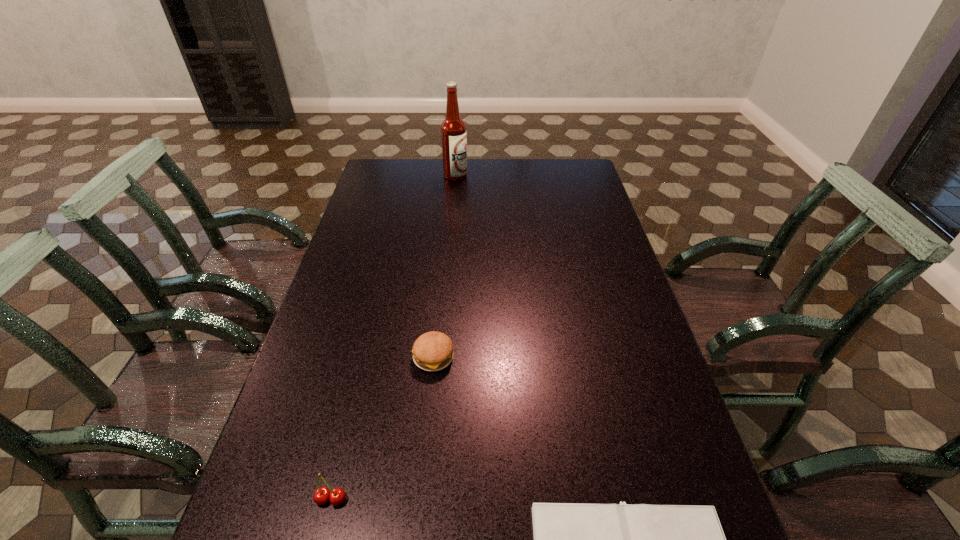
Identify the location of vacant space at the far edge of the desktop. (528, 185).

Image resolution: width=960 pixels, height=540 pixels. Find the location of `vacant area at the left edge of the desktop`. vacant area at the left edge of the desktop is located at coordinates (336, 474).

This screenshot has width=960, height=540. What are the coordinates of `free space at the right edge` in the screenshot? It's located at tap(601, 326).

Locate an element on the screen. The width and height of the screenshot is (960, 540). vacant position at the far left corner of the desktop is located at coordinates (387, 159).

Identify the location of vacant space at the far right corner of the desktop. (579, 174).

At what (x,y) coordinates should I click in order to perform the action: click on vacant area between the cherry and the alcohol. Please return your answer as a coordinate pair (x, y). The width and height of the screenshot is (960, 540). Looking at the image, I should click on (394, 337).

Where is `empty location between the third shortest object and the tallest object`? The image size is (960, 540). empty location between the third shortest object and the tallest object is located at coordinates (394, 337).

This screenshot has width=960, height=540. In order to click on free space between the farthest object and the second shortest object in this screenshot , I will do `click(444, 266)`.

The height and width of the screenshot is (540, 960). Find the location of `blank region between the third nearest object and the leftmost object`. blank region between the third nearest object and the leftmost object is located at coordinates (382, 428).

Image resolution: width=960 pixels, height=540 pixels. Identify the location of object that stands as the closest to the farthest object. (433, 351).